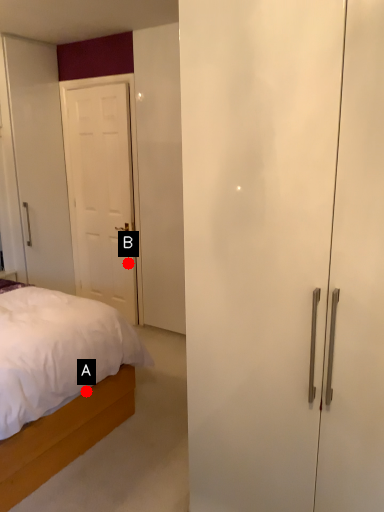
Question: Two points are circled on the image, labeled by A and B beside each circle. Which point appears closest to the camera in this image?

Choices:
 (A) A is closer
 (B) B is closer

Answer: (A)